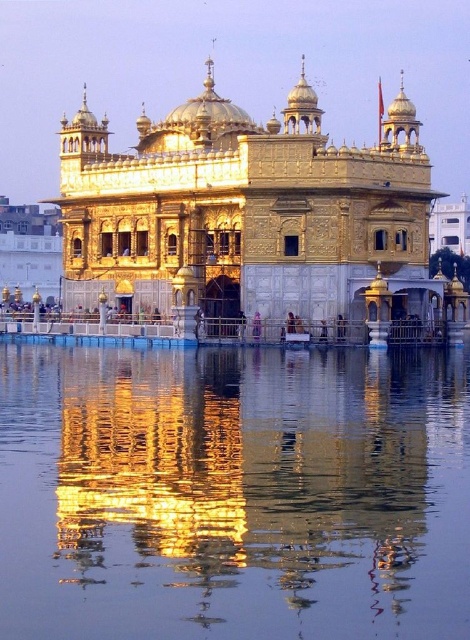
Question: Can you confirm if transparent liquid water at center is positioned to the right of golden polished temple at center?

Choices:
 (A) no
 (B) yes

Answer: (A)

Question: Among these points, which one is nearest to the camera?

Choices:
 (A) (169, 552)
 (B) (258, 256)

Answer: (A)

Question: Is transparent liquid water at center behind golden polished temple at center?

Choices:
 (A) no
 (B) yes

Answer: (A)

Question: Is transparent liquid water at center smaller than golden polished temple at center?

Choices:
 (A) no
 (B) yes

Answer: (B)